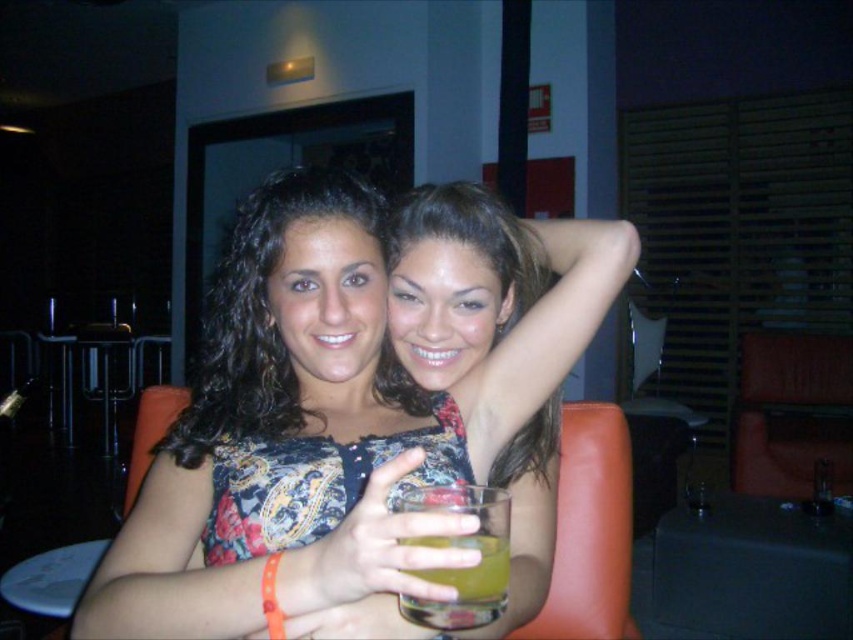
Question: Among these points, which one is nearest to the camera?

Choices:
 (A) (792, 428)
 (B) (440, 496)
 (C) (540, 634)
 (D) (479, 237)

Answer: (B)

Question: Which object is positioned closest to the leather armchair at right?

Choices:
 (A) translucent glass at center
 (B) matte floral dress at center
 (C) leather at right

Answer: (C)

Question: Which point appears farthest from the camera in this image?

Choices:
 (A) (596, 442)
 (B) (801, 452)
 (C) (473, 602)

Answer: (B)

Question: Is matte floral dress at center to the right of translucent glass at center from the viewer's perspective?

Choices:
 (A) no
 (B) yes

Answer: (B)

Question: Is floral-patterned dress at center wider than translucent glass at center?

Choices:
 (A) yes
 (B) no

Answer: (A)

Question: Is leather armchair at right below translucent glass at center?

Choices:
 (A) no
 (B) yes

Answer: (B)